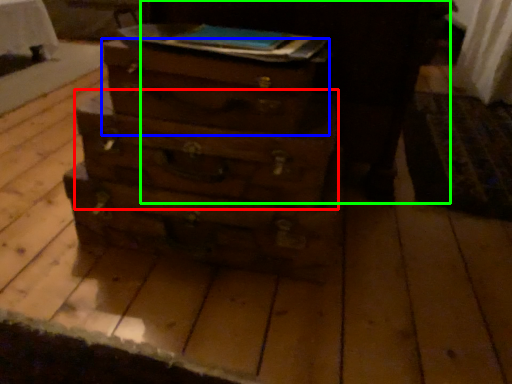
Question: Which is farther away from drawer (highlighted by a red box)? drawer (highlighted by a blue box) or dark (highlighted by a green box)?

Choices:
 (A) drawer
 (B) dark

Answer: (B)